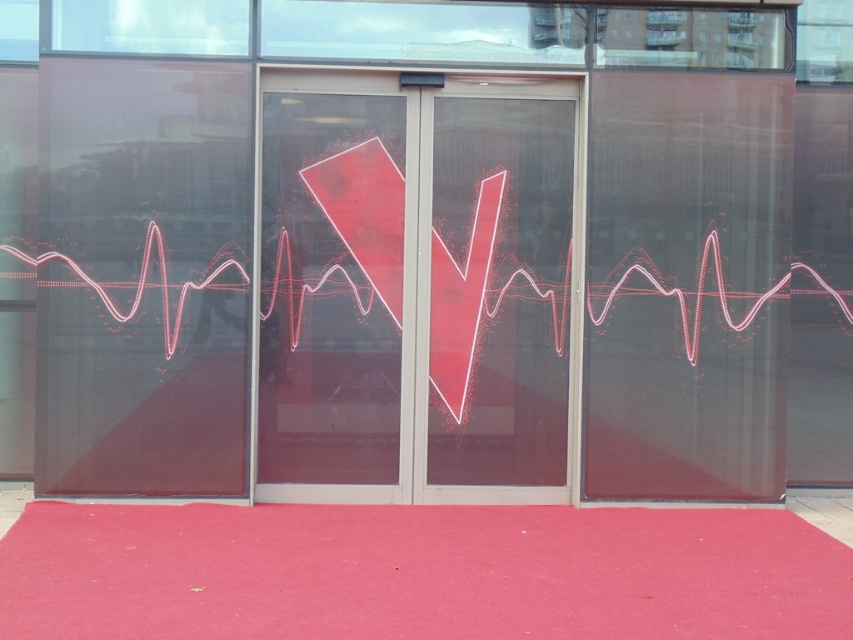
Describe the element at coordinates (419, 288) in the screenshot. The width and height of the screenshot is (853, 640). I see `transparent glass door at center` at that location.

Between point (460, 406) and point (699, 605), which one is positioned behind?

The point (460, 406) is behind.

Identify the location of transparent glass door at center. point(419,288).